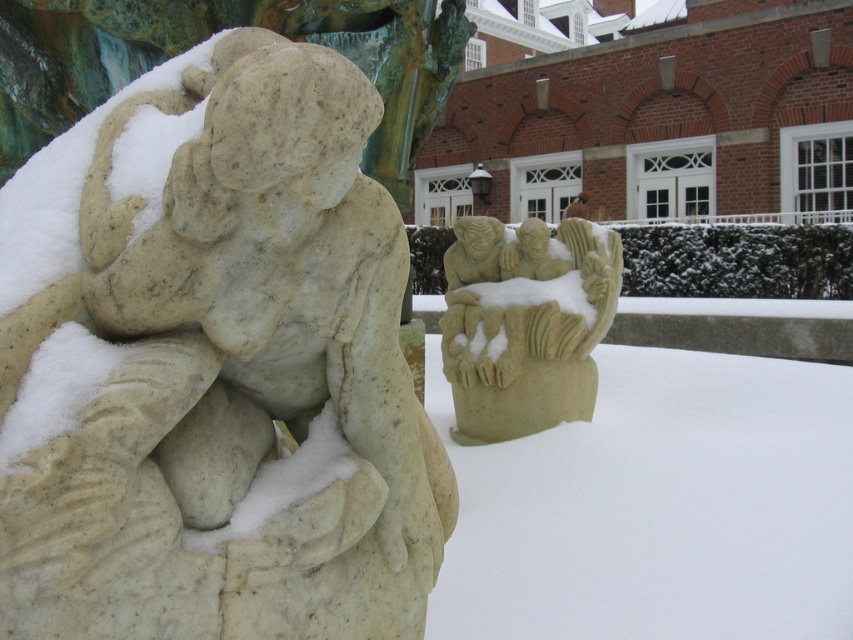
You are standing in the snowy outdoor scene and want to take a photo of both the white marble statue at left and the beige stone carving at center. Since you can only frame one in the foreground, which one should you choose to ensure the other appears in the background?

You should choose the white marble statue at left as the foreground because it is positioned on the left side of the beige stone carving at center, so the beige stone carving at center will naturally appear in the background when the white marble statue at left is framed in front.

You are standing in the snowy outdoor scene and want to take a photo of both the white marble statue at left and the beige stone carving at center. Which statue should you adjust your camera angle to look up at?

You should adjust your camera angle to look up at the beige stone carving at center because the white marble statue at left is below it.